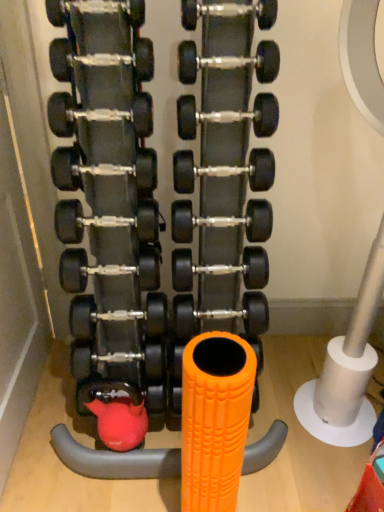
At what (x,y) coordinates should I click in order to perform the action: click on black rubber dumbbell at center, placed as the third dumbbell when sorted from top to bottom. Please return your answer as a coordinate pair (x, y). Looking at the image, I should click on (229, 62).

Describe the element at coordinates (214, 419) in the screenshot. I see `orange textured foam roller at center` at that location.

Measure the distance between point (189, 230) and camera.

The distance of point (189, 230) from camera is 1.20 meters.

Locate an element on the screen. Image resolution: width=384 pixels, height=512 pixels. black rubber dumbbell at center, acting as the 4th dumbbell starting from the bottom is located at coordinates (108, 269).

Find the location of `matte black dumbbell at upper center, the fourteenth dumbbell positioned from the bottom`. matte black dumbbell at upper center, the fourteenth dumbbell positioned from the bottom is located at coordinates (95, 9).

This screenshot has height=512, width=384. What do you see at coordinates (101, 59) in the screenshot?
I see `black rubber dumbbell at center, which is counted as the 4th dumbbell, starting from the top` at bounding box center [101, 59].

How much space does polished silver dumbbell at center, positioned as the 15th dumbbell in top-to-bottom order, occupy horizontally?

It is 4.44 inches.

The image size is (384, 512). I want to click on black rubber dumbbell at center, which is the 5th dumbbell in bottom-to-top order, so click(221, 269).

Which is in front, point (215, 11) or point (227, 489)?

Point (227, 489)

Looking at this image, how different are the orientations of black rubber dumbbell at upper center, the 15th dumbbell in the bottom-to-top sequence, and orange textured foam roller at center in degrees?

The angular difference between black rubber dumbbell at upper center, the 15th dumbbell in the bottom-to-top sequence, and orange textured foam roller at center is 2.33 degrees.

Considering the relative sizes of black rubber dumbbell at upper center, the 15th dumbbell in the bottom-to-top sequence, and orange textured foam roller at center in the image provided, is black rubber dumbbell at upper center, the 15th dumbbell in the bottom-to-top sequence, wider than orange textured foam roller at center?

In fact, black rubber dumbbell at upper center, the 15th dumbbell in the bottom-to-top sequence, might be narrower than orange textured foam roller at center.

Measure the distance from black rubber dumbbell at upper center, the 15th dumbbell in the bottom-to-top sequence, to orange textured foam roller at center.

black rubber dumbbell at upper center, the 15th dumbbell in the bottom-to-top sequence, is 88.20 centimeters away from orange textured foam roller at center.

How different are the orientations of black rubber dumbbell at center, positioned as the ninth dumbbell in top-to-bottom order, and black rubber dumbbell at center, the twelfth dumbbell positioned from the top, in degrees?

There is a 1.93-degree angle between the facing directions of black rubber dumbbell at center, positioned as the ninth dumbbell in top-to-bottom order, and black rubber dumbbell at center, the twelfth dumbbell positioned from the top.

From a real-world perspective, relative to black rubber dumbbell at center, the twelfth dumbbell positioned from the top, is black rubber dumbbell at center, which ranks as the 7th dumbbell in bottom-to-top order, vertically above or below?

In terms of real-world spatial position, black rubber dumbbell at center, which ranks as the 7th dumbbell in bottom-to-top order, is above black rubber dumbbell at center, the twelfth dumbbell positioned from the top.

From the image's perspective, would you say black rubber dumbbell at center, positioned as the ninth dumbbell in top-to-bottom order, is shown under black rubber dumbbell at center, acting as the 4th dumbbell starting from the bottom?

Actually, black rubber dumbbell at center, positioned as the ninth dumbbell in top-to-bottom order, appears above black rubber dumbbell at center, acting as the 4th dumbbell starting from the bottom, in the image.

Find the location of a particular element. the 8th dumbbell to the left of the black rubber dumbbell at center, positioned as the ninth dumbbell in top-to-bottom order, counting from the anchor's position is located at coordinates click(x=108, y=269).

Would you say black rubber dumbbell at center, the 6th dumbbell when ordered from top to bottom, is a long distance from black rubber dumbbell at center, positioned as the ninth dumbbell in top-to-bottom order?

That's not correct — black rubber dumbbell at center, the 6th dumbbell when ordered from top to bottom, is a little close to black rubber dumbbell at center, positioned as the ninth dumbbell in top-to-bottom order.

From the image's perspective, which one is positioned lower, black rubber dumbbell at center, the 6th dumbbell when ordered from top to bottom, or black rubber dumbbell at center, which ranks as the 7th dumbbell in bottom-to-top order?

black rubber dumbbell at center, which ranks as the 7th dumbbell in bottom-to-top order, is shown below in the image.

Considering the relative positions of black rubber dumbbell at center, the 10th dumbbell ordered from the bottom, and black rubber dumbbell at center, which ranks as the 7th dumbbell in bottom-to-top order, in the image provided, is black rubber dumbbell at center, the 10th dumbbell ordered from the bottom, to the left of black rubber dumbbell at center, which ranks as the 7th dumbbell in bottom-to-top order, from the viewer's perspective?

Correct, you'll find black rubber dumbbell at center, the 10th dumbbell ordered from the bottom, to the left of black rubber dumbbell at center, which ranks as the 7th dumbbell in bottom-to-top order.

From a real-world perspective, is black rubber dumbbell at center, the 6th dumbbell when ordered from top to bottom, physically located above or below black rubber dumbbell at center, positioned as the ninth dumbbell in top-to-bottom order?

From a real-world perspective, black rubber dumbbell at center, the 6th dumbbell when ordered from top to bottom, is physically above black rubber dumbbell at center, positioned as the ninth dumbbell in top-to-bottom order.

Considering the sizes of objects black rubber dumbbell at center, positioned as the ninth dumbbell in top-to-bottom order, and black rubber dumbbell at center, which is the 5th dumbbell in bottom-to-top order, in the image provided, who is thinner, black rubber dumbbell at center, positioned as the ninth dumbbell in top-to-bottom order, or black rubber dumbbell at center, which is the 5th dumbbell in bottom-to-top order,?

Thinner between the two is black rubber dumbbell at center, positioned as the ninth dumbbell in top-to-bottom order.

Looking at this image, from the image's perspective, between black rubber dumbbell at center, which ranks as the 7th dumbbell in bottom-to-top order, and black rubber dumbbell at center, which is the 5th dumbbell in bottom-to-top order, who is located below?

black rubber dumbbell at center, which is the 5th dumbbell in bottom-to-top order, appears lower in the image.

Considering the relative sizes of black rubber dumbbell at center, positioned as the ninth dumbbell in top-to-bottom order, and black rubber dumbbell at center, which is the 5th dumbbell in bottom-to-top order, in the image provided, is black rubber dumbbell at center, positioned as the ninth dumbbell in top-to-bottom order, bigger than black rubber dumbbell at center, which is the 5th dumbbell in bottom-to-top order,?

No.

Find the location of a particular element. This screenshot has height=512, width=384. the 2nd dumbbell located beneath the black rubber dumbbell at center, the twelfth dumbbell in the bottom-to-top sequence (from a real-world perspective) is located at coordinates (98, 114).

Which of these two, black rubber dumbbell at center, the twelfth dumbbell in the bottom-to-top sequence, or black rubber dumbbell at center, the 10th dumbbell ordered from the bottom, is smaller?

Smaller between the two is black rubber dumbbell at center, the twelfth dumbbell in the bottom-to-top sequence.

From the image's perspective, which is below, black rubber dumbbell at center, which is counted as the 4th dumbbell, starting from the top, or black rubber dumbbell at center, the 10th dumbbell ordered from the bottom?

From the image's view, black rubber dumbbell at center, the 10th dumbbell ordered from the bottom, is below.

Between black rubber dumbbell at center, which is counted as the 4th dumbbell, starting from the top, and black rubber dumbbell at center, the 6th dumbbell when ordered from top to bottom, which one has less height?

With less height is black rubber dumbbell at center, which is counted as the 4th dumbbell, starting from the top.

Considering the positions of point (141, 111) and point (220, 122), is point (141, 111) closer or farther from the camera than point (220, 122)?

Point (141, 111) is positioned closer to the camera compared to point (220, 122).

Is black rubber dumbbell at center, the 10th dumbbell ordered from the bottom, further to the viewer compared to black rubber dumbbell at center, which is the 11th dumbbell from bottom to top?

No, black rubber dumbbell at center, the 10th dumbbell ordered from the bottom, is closer to the viewer.

Is black rubber dumbbell at center, the 6th dumbbell when ordered from top to bottom, at the left side of black rubber dumbbell at center, which is the 11th dumbbell from bottom to top?

Correct, you'll find black rubber dumbbell at center, the 6th dumbbell when ordered from top to bottom, to the left of black rubber dumbbell at center, which is the 11th dumbbell from bottom to top.

Locate an element on the screen. the 8th dumbbell to the right of the black rubber dumbbell at center, the 10th dumbbell ordered from the bottom, starting your count from the anchor is located at coordinates (228, 116).

Is black rubber dumbbell at center, arranged as the eleventh dumbbell when viewed from the top, closer to the viewer compared to black rubber dumbbell at center, the 13th dumbbell ordered from the bottom?

No.

Between black rubber dumbbell at center, arranged as the eleventh dumbbell when viewed from the top, and black rubber dumbbell at center, placed as the third dumbbell when sorted from top to bottom, which one has larger width?

With larger width is black rubber dumbbell at center, arranged as the eleventh dumbbell when viewed from the top.

Is black rubber dumbbell at center, arranged as the eleventh dumbbell when viewed from the top, located outside black rubber dumbbell at center, placed as the third dumbbell when sorted from top to bottom?

black rubber dumbbell at center, arranged as the eleventh dumbbell when viewed from the top, lies outside black rubber dumbbell at center, placed as the third dumbbell when sorted from top to bottom,'s area.

Looking at this image, is black rubber dumbbell at center, arranged as the eleventh dumbbell when viewed from the top, taller than black rubber dumbbell at center, the 13th dumbbell ordered from the bottom?

Yes, black rubber dumbbell at center, arranged as the eleventh dumbbell when viewed from the top, is taller than black rubber dumbbell at center, the 13th dumbbell ordered from the bottom.

Identify the location of the 14th dumbbell above the orange textured foam roller at center (from a real-world perspective). (229, 12).

Which dumbbell is the 1st one when counting from the front of the black rubber dumbbell at center, the twelfth dumbbell positioned from the top? Please provide its 2D coordinates.

[(222, 221)]

Looking at the image, which one is located further to black rubber dumbbell at center, which is the 8th dumbbell from top to bottom, black rubber dumbbell at upper center, marked as the 1th dumbbell in a top-to-bottom arrangement, or orange textured foam roller at center?

Among the two, orange textured foam roller at center is located further to black rubber dumbbell at center, which is the 8th dumbbell from top to bottom.

From the image, which object appears to be nearer to black rubber dumbbell at upper center, marked as the 1th dumbbell in a top-to-bottom arrangement, black rubber dumbbell at center, acting as the 4th dumbbell starting from the bottom, or black rubber dumbbell at center, the 6th dumbbell when ordered from top to bottom?

black rubber dumbbell at center, the 6th dumbbell when ordered from top to bottom.

Based on their spatial positions, is black rubber dumbbell at center, the twelfth dumbbell positioned from the top, or matte black dumbbell at upper center, the fourteenth dumbbell positioned from the bottom, closer to black rubber dumbbell at center, the eighth dumbbell in the bottom-to-top sequence?

Among the two, black rubber dumbbell at center, the twelfth dumbbell positioned from the top, is located nearer to black rubber dumbbell at center, the eighth dumbbell in the bottom-to-top sequence.

Estimate the real-world distances between objects in this image. Which object is closer to black rubber dumbbell at center, the twelfth dumbbell in the bottom-to-top sequence, black rubber dumbbell at center, which is the 11th dumbbell from bottom to top, or black rubber dumbbell at center, which is the 3th dumbbell from bottom to top?

The object closer to black rubber dumbbell at center, the twelfth dumbbell in the bottom-to-top sequence, is black rubber dumbbell at center, which is the 11th dumbbell from bottom to top.

Estimate the real-world distances between objects in this image. Which object is further from black rubber dumbbell at center, placed as the third dumbbell when sorted from top to bottom, black rubber dumbbell at center, which is the second dumbbell in bottom-to-top order, or black rubber dumbbell at center, which is counted as the 4th dumbbell, starting from the top?

black rubber dumbbell at center, which is the second dumbbell in bottom-to-top order.

Looking at this image, when comparing their distances from black rubber dumbbell at center, which is the fifth dumbbell from top to bottom, does black rubber dumbbell at center, which ranks as the 14th dumbbell in top-to-bottom order, or black rubber dumbbell at center, which is the thirteenth dumbbell from top to bottom, seem closer?

black rubber dumbbell at center, which is the thirteenth dumbbell from top to bottom, is closer to black rubber dumbbell at center, which is the fifth dumbbell from top to bottom.

Looking at the image, which one is located closer to black rubber dumbbell at center, the twelfth dumbbell in the bottom-to-top sequence, polished silver dumbbell at center, positioned as the 15th dumbbell in top-to-bottom order, or black rubber dumbbell at center, which is the 11th dumbbell from bottom to top?

black rubber dumbbell at center, which is the 11th dumbbell from bottom to top, is positioned closer to the anchor black rubber dumbbell at center, the twelfth dumbbell in the bottom-to-top sequence.

Estimate the real-world distances between objects in this image. Which object is further from black rubber dumbbell at center, which is the 5th dumbbell in bottom-to-top order, black rubber dumbbell at center, which is the 3th dumbbell from bottom to top, or black rubber dumbbell at center, arranged as the 7th dumbbell when viewed from the top?

black rubber dumbbell at center, arranged as the 7th dumbbell when viewed from the top, is positioned further to the anchor black rubber dumbbell at center, which is the 5th dumbbell in bottom-to-top order.

At what (x,y) coordinates should I click in order to perform the action: click on traffic cone between orange textured foam roller at center and black rubber dumbbell at center, which ranks as the 14th dumbbell in top-to-bottom order, from front to back. Please return your answer as a coordinate pair (x, y). This screenshot has height=512, width=384. Looking at the image, I should click on (214, 419).

At what (x,y) coordinates should I click in order to perform the action: click on traffic cone between orange textured foam roller at center and black rubber dumbbell at center, which is the thirteenth dumbbell from top to bottom, in the front-back direction. Please return your answer as a coordinate pair (x, y). Looking at the image, I should click on (214, 419).

Find the location of a particular element. The image size is (384, 512). barbell between matte black dumbbell at upper center, the fourteenth dumbbell positioned from the bottom, and polished silver dumbbell at center, which is the first dumbbell in bottom-to-top order, in the vertical direction is located at coordinates (129, 402).

Image resolution: width=384 pixels, height=512 pixels. What are the coordinates of `barbell between black rubber dumbbell at upper center, the 15th dumbbell in the bottom-to-top sequence, and black rubber dumbbell at center, the twelfth dumbbell positioned from the top, from top to bottom` in the screenshot? It's located at (129, 402).